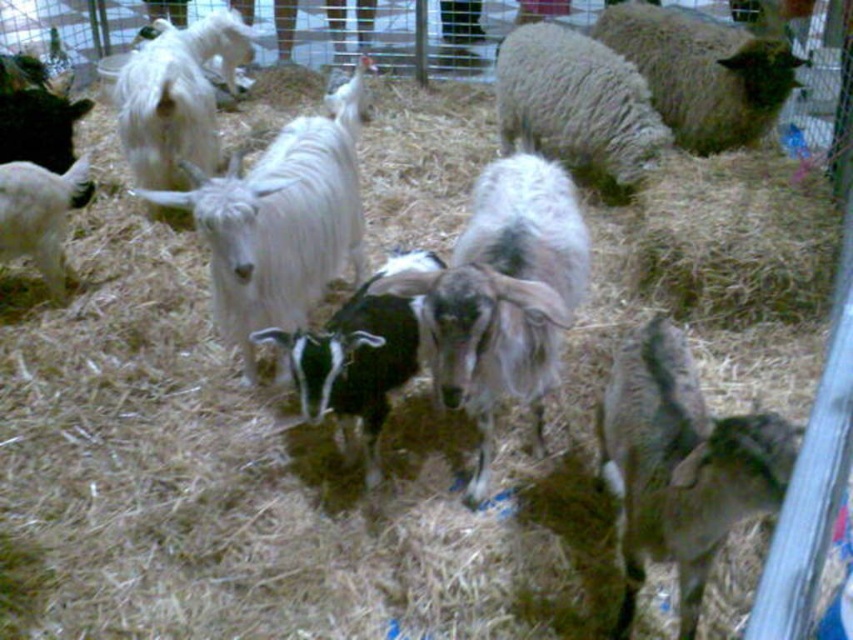
Question: Does black and white fur at center appear over white fluffy goat at upper left?

Choices:
 (A) no
 (B) yes

Answer: (A)

Question: Which is farther from the white woolen goat at center?

Choices:
 (A) black and white fur goat at center
 (B) fluffy white sheep at upper right
 (C) dark brown woolen goat at lower right
 (D) white woolen sheep at center

Answer: (B)

Question: Considering the relative positions of dark brown woolen goat at lower right and fluffy white sheep at upper right in the image provided, where is dark brown woolen goat at lower right located with respect to fluffy white sheep at upper right?

Choices:
 (A) above
 (B) below

Answer: (B)

Question: Which of the following is the closest to the observer?

Choices:
 (A) (198, 125)
 (B) (573, 280)
 (C) (55, 202)
 (D) (334, 342)

Answer: (D)

Question: Which object is the farthest from the white woolen goat at left?

Choices:
 (A) white woolen goat at center
 (B) fluffy white sheep at upper right

Answer: (B)

Question: Does dark brown woolen goat at lower right appear under white fluffy goat at upper left?

Choices:
 (A) yes
 (B) no

Answer: (A)